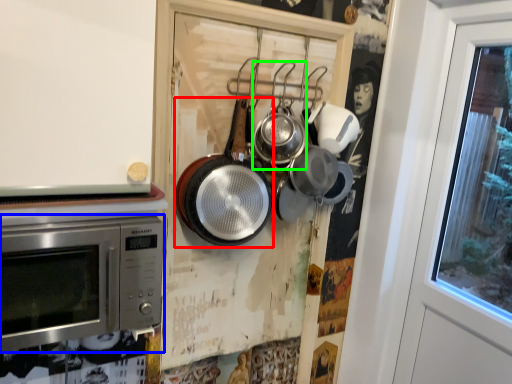
Question: Which object is the farthest from frying pan (highlighted by a red box)? Choose among these: microwave oven (highlighted by a blue box) or frying pan (highlighted by a green box).

Choices:
 (A) microwave oven
 (B) frying pan

Answer: (A)